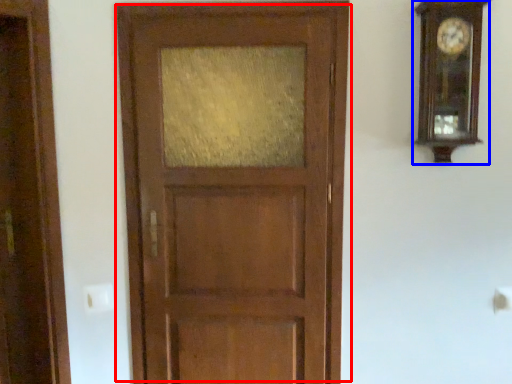
Question: Which object appears closest to the camera in this image, door (highlighted by a red box) or clock (highlighted by a blue box)?

Choices:
 (A) door
 (B) clock

Answer: (B)